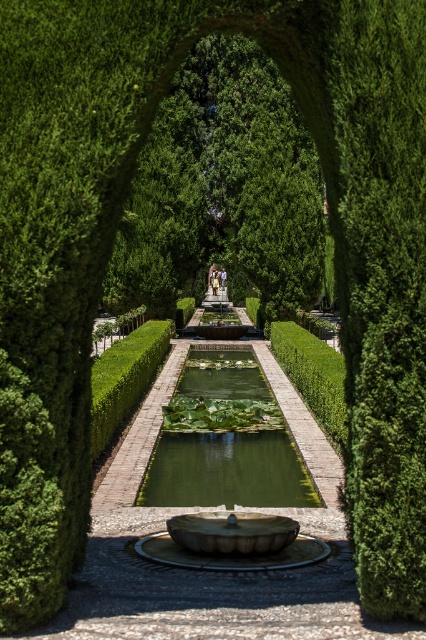
You are standing at the entrance of the garden and see two points marked in the scene. The first point is at coordinates point (290, 506), and the second is at point (109, 362). Which point is closer to you as you face the garden?

Point (290, 506) is in front of point (109, 362), so the first point is closer to you.

You are standing in the garden and want to take a photo of both the green leafy tree at center and the green polished stone hedge at center. Which object will appear larger in the photo?

The green leafy tree at center will appear larger in the photo because it is closer to the viewer than the green polished stone hedge at center.

You are designing a garden layout and need to place two elements, the green mossy pond at center and the green polished stone hedge at center. Based on the scene, which one should you place first if you want to prioritize the larger element?

The green polished stone hedge at center is larger than the green mossy pond at center, so you should place the green polished stone hedge at center first to prioritize the larger element.